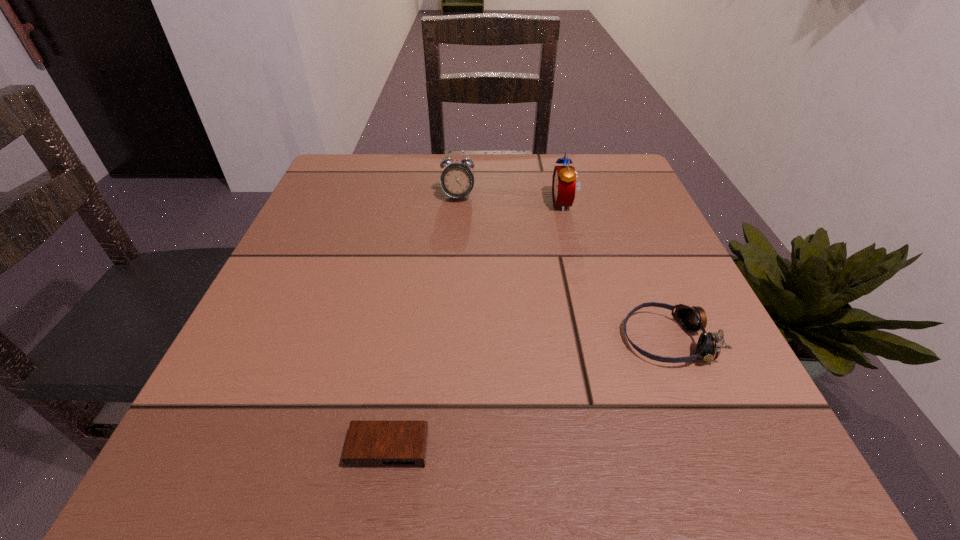
In order to click on vacant space located on the face of the second shortest alarm clock in this screenshot , I will do `click(455, 243)`.

Find the location of a particular element. This screenshot has width=960, height=540. free region located 0.080m through the lenses of the goggles is located at coordinates (571, 340).

Image resolution: width=960 pixels, height=540 pixels. What are the coordinates of `vacant space located through the lenses of the goggles` in the screenshot? It's located at (416, 340).

Identify the location of vacant space located 0.100m through the lenses of the goggles. The height and width of the screenshot is (540, 960). (559, 340).

Find the location of `object that is at the near edge`. object that is at the near edge is located at coordinates (369, 444).

You are a GUI agent. You are given a task and a screenshot of the screen. Output one action in this format:
    pyautogui.click(x=<x>, y=<y>)
    Task: Click on the alarm clock that is at the right edge
    
    Given the screenshot: What is the action you would take?
    pyautogui.click(x=564, y=184)

Locate an element on the screen. goggles at the right edge is located at coordinates (692, 319).

Where is `object at the far right corner`? object at the far right corner is located at coordinates (564, 184).

This screenshot has height=540, width=960. I want to click on free space at the far edge of the desktop, so click(498, 203).

Locate an element on the screen. The height and width of the screenshot is (540, 960). vacant space at the left edge of the desktop is located at coordinates [370, 224].